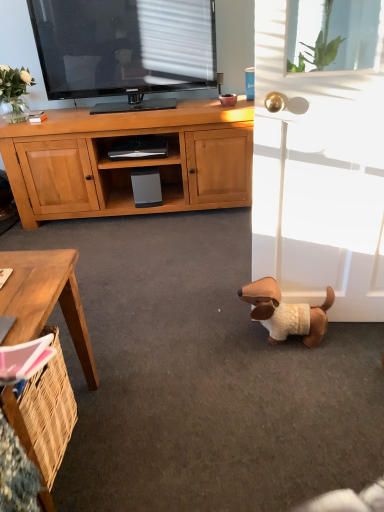
Question: Is transparent glass window screen at upper right aimed at brown wooden desk at lower left?

Choices:
 (A) yes
 (B) no

Answer: (B)

Question: Does transparent glass window screen at upper right have a lesser width compared to brown wooden desk at lower left?

Choices:
 (A) yes
 (B) no

Answer: (A)

Question: Is transparent glass window screen at upper right smaller than brown wooden desk at lower left?

Choices:
 (A) yes
 (B) no

Answer: (A)

Question: Can you confirm if transparent glass window screen at upper right is shorter than brown wooden desk at lower left?

Choices:
 (A) no
 (B) yes

Answer: (B)

Question: From a real-world perspective, is transparent glass window screen at upper right positioned under brown wooden desk at lower left based on gravity?

Choices:
 (A) yes
 (B) no

Answer: (B)

Question: Is transparent glass window screen at upper right bigger than brown wooden desk at lower left?

Choices:
 (A) yes
 (B) no

Answer: (B)

Question: Could you tell me if brown plush dog at lower right is facing white matte screen door at lower right?

Choices:
 (A) yes
 (B) no

Answer: (B)

Question: Does brown plush dog at lower right have a greater height compared to white matte screen door at lower right?

Choices:
 (A) no
 (B) yes

Answer: (A)

Question: Is brown plush dog at lower right further to the viewer compared to white matte screen door at lower right?

Choices:
 (A) no
 (B) yes

Answer: (B)

Question: Is brown plush dog at lower right wider than white matte screen door at lower right?

Choices:
 (A) yes
 (B) no

Answer: (B)

Question: From the image's perspective, is brown plush dog at lower right above white matte screen door at lower right?

Choices:
 (A) yes
 (B) no

Answer: (B)

Question: Is there a large distance between brown plush dog at lower right and white matte screen door at lower right?

Choices:
 (A) yes
 (B) no

Answer: (B)

Question: From a real-world perspective, is brown plush dog at lower right on top of transparent glass window screen at upper right?

Choices:
 (A) no
 (B) yes

Answer: (A)